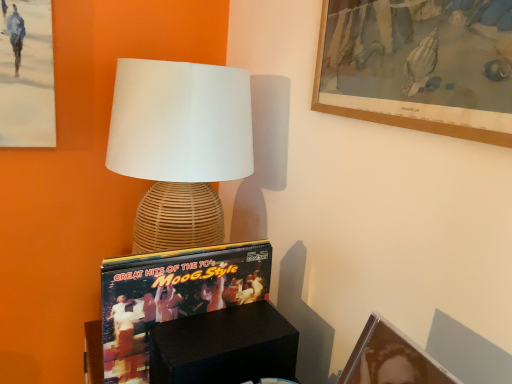
Question: Should I look upward or downward to see black matte box at lower center?

Choices:
 (A) down
 (B) up

Answer: (A)

Question: Considering the relative sizes of matte black picture frame at lower right, the second picture frame in the top-to-bottom sequence, and black matte box at lower center in the image provided, is matte black picture frame at lower right, the second picture frame in the top-to-bottom sequence, shorter than black matte box at lower center?

Choices:
 (A) yes
 (B) no

Answer: (A)

Question: Is matte black picture frame at lower right, the 1th picture frame in the bottom-to-top sequence, behind black matte box at lower center?

Choices:
 (A) yes
 (B) no

Answer: (B)

Question: Is matte black picture frame at lower right, the 1th picture frame in the bottom-to-top sequence, oriented towards black matte box at lower center?

Choices:
 (A) no
 (B) yes

Answer: (A)

Question: Is black matte box at lower center inside matte black picture frame at lower right, the second picture frame in the top-to-bottom sequence?

Choices:
 (A) yes
 (B) no

Answer: (B)

Question: Does matte black picture frame at lower right, the second picture frame in the top-to-bottom sequence, have a larger size compared to black matte box at lower center?

Choices:
 (A) yes
 (B) no

Answer: (B)

Question: From a real-world perspective, does matte black picture frame at lower right, the 1th picture frame in the bottom-to-top sequence, stand above black matte box at lower center?

Choices:
 (A) yes
 (B) no

Answer: (A)

Question: Is matte black picture frame at lower right, the 1th picture frame in the bottom-to-top sequence, at the back of wooden picture frame at upper right, the 1th picture frame viewed from the top?

Choices:
 (A) no
 (B) yes

Answer: (A)

Question: From the image's perspective, is wooden picture frame at upper right, which is the 2th picture frame from bottom to top, located above matte black picture frame at lower right, the second picture frame in the top-to-bottom sequence?

Choices:
 (A) no
 (B) yes

Answer: (B)

Question: Can you confirm if wooden picture frame at upper right, which is the 2th picture frame from bottom to top, is thinner than matte black picture frame at lower right, the 1th picture frame in the bottom-to-top sequence?

Choices:
 (A) no
 (B) yes

Answer: (B)

Question: Is wooden picture frame at upper right, the 1th picture frame viewed from the top, taller than matte black picture frame at lower right, the second picture frame in the top-to-bottom sequence?

Choices:
 (A) no
 (B) yes

Answer: (B)

Question: Could you tell me if wooden picture frame at upper right, which is the 2th picture frame from bottom to top, is turned towards matte black picture frame at lower right, the 1th picture frame in the bottom-to-top sequence?

Choices:
 (A) yes
 (B) no

Answer: (B)

Question: Does wooden picture frame at upper right, the 1th picture frame viewed from the top, have a smaller size compared to matte black picture frame at lower right, the second picture frame in the top-to-bottom sequence?

Choices:
 (A) no
 (B) yes

Answer: (A)

Question: Is matte black picture frame at lower right, the second picture frame in the top-to-bottom sequence, not inside wooden picture frame at upper right, which is the 2th picture frame from bottom to top?

Choices:
 (A) yes
 (B) no

Answer: (A)